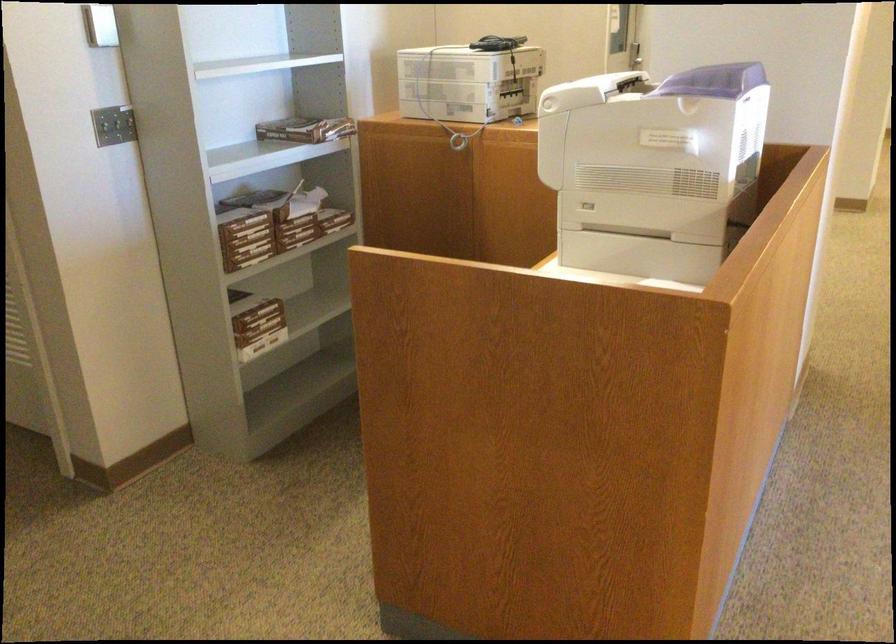
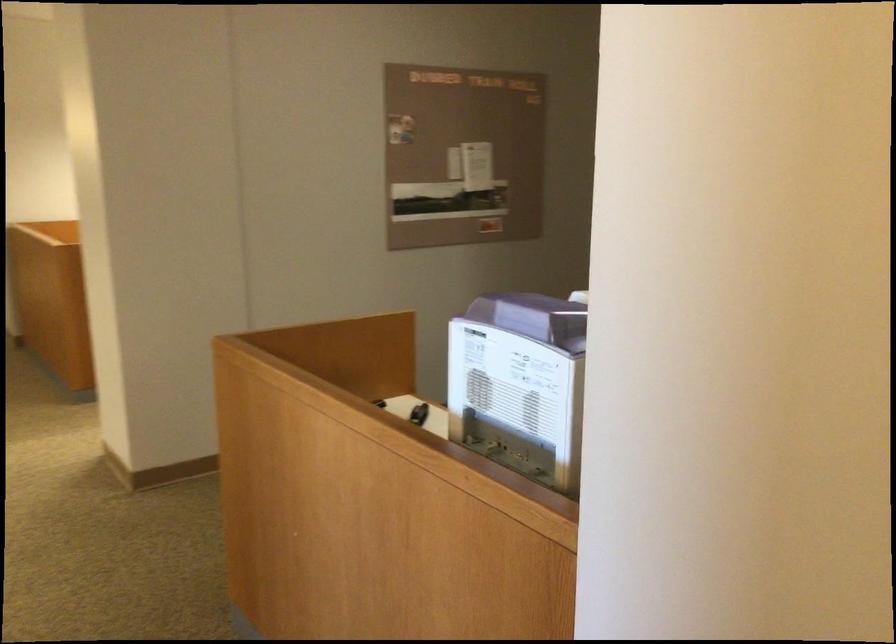
Question: I am providing you with two images of the same scene from different viewpoints. Please identify which objects are invisible in image2.

Choices:
 (A) purple machine lid
 (B) white patterned backpack
 (C) small black object
 (D) printer paper tray

Answer: (D)